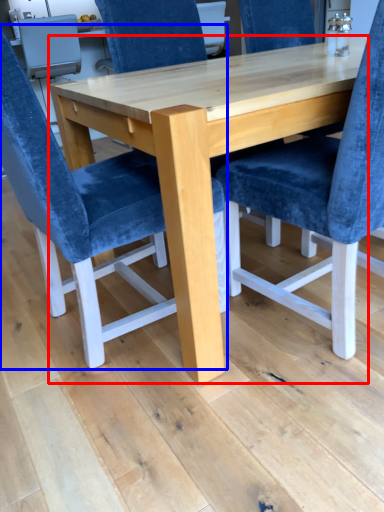
Question: Among these objects, which one is farthest to the camera, table (highlighted by a red box) or chair (highlighted by a blue box)?

Choices:
 (A) table
 (B) chair

Answer: (A)